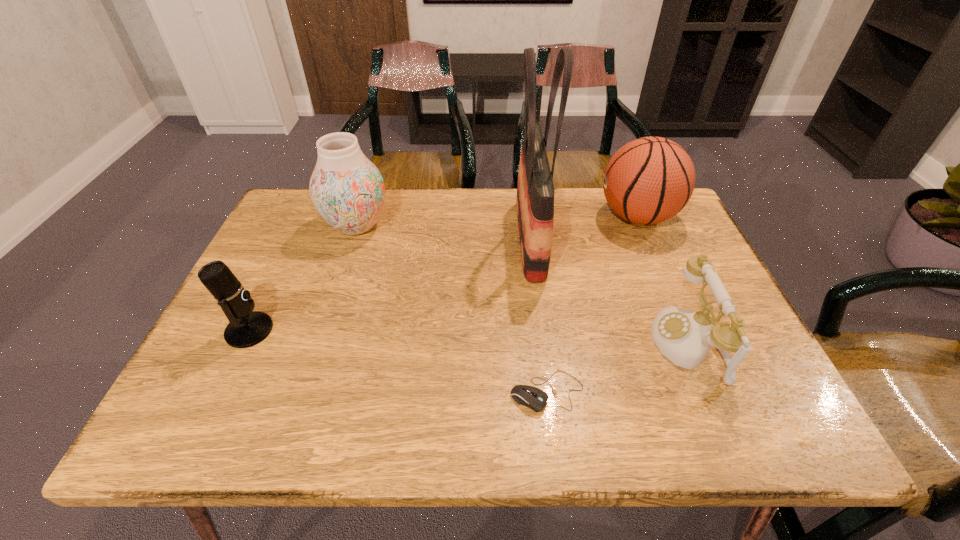
The image size is (960, 540). I want to click on the tallest object, so 535,190.

Find the location of a particular element. Image resolution: width=960 pixels, height=540 pixels. the second object from left to right is located at coordinates (347, 189).

This screenshot has width=960, height=540. Find the location of `basketball`. basketball is located at coordinates (649, 180).

Identify the location of microphone. The width and height of the screenshot is (960, 540). (247, 328).

The height and width of the screenshot is (540, 960). I want to click on telephone, so click(685, 337).

This screenshot has width=960, height=540. In order to click on the shortest object in this screenshot , I will do `click(534, 398)`.

Identify the location of free region located 0.280m on the front-facing side of the tallest object. This screenshot has width=960, height=540. (411, 239).

Identify the location of free space located on the front-facing side of the tallest object. The width and height of the screenshot is (960, 540). (480, 239).

This screenshot has height=540, width=960. I want to click on free space located on the front-facing side of the tallest object, so click(x=396, y=239).

At what (x,y) coordinates should I click in order to perform the action: click on vacant space located on the front of the second object from left to right. Please return your answer as a coordinate pair (x, y). Looking at the image, I should click on (310, 366).